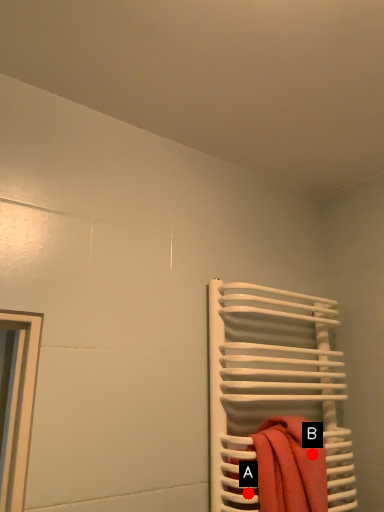
Question: Two points are circled on the image, labeled by A and B beside each circle. Which point is farther to the camera?

Choices:
 (A) A is further
 (B) B is further

Answer: (B)